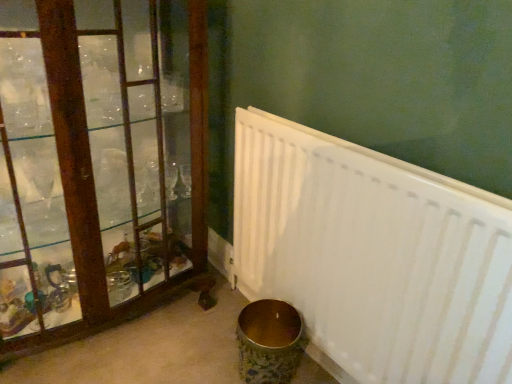
Question: Should I look upward or downward to see wooden frame at left?

Choices:
 (A) up
 (B) down

Answer: (A)

Question: Is white matte radiator at lower right positioned with its back to wooden frame at left?

Choices:
 (A) no
 (B) yes

Answer: (A)

Question: Are white matte radiator at lower right and wooden frame at left located far from each other?

Choices:
 (A) yes
 (B) no

Answer: (B)

Question: From a real-world perspective, is white matte radiator at lower right located higher than wooden frame at left?

Choices:
 (A) no
 (B) yes

Answer: (A)

Question: Does white matte radiator at lower right have a lesser height compared to wooden frame at left?

Choices:
 (A) yes
 (B) no

Answer: (A)

Question: Can you confirm if white matte radiator at lower right is positioned to the left of wooden frame at left?

Choices:
 (A) yes
 (B) no

Answer: (B)

Question: Is white matte radiator at lower right wider than wooden frame at left?

Choices:
 (A) yes
 (B) no

Answer: (B)

Question: Are wooden frame at left and white matte radiator at lower right beside each other?

Choices:
 (A) no
 (B) yes

Answer: (A)

Question: Is white matte radiator at lower right at the back of wooden frame at left?

Choices:
 (A) no
 (B) yes

Answer: (A)

Question: Could you tell me if wooden frame at left is turned towards white matte radiator at lower right?

Choices:
 (A) yes
 (B) no

Answer: (B)

Question: Can you confirm if wooden frame at left is positioned to the left of white matte radiator at lower right?

Choices:
 (A) no
 (B) yes

Answer: (B)

Question: Would you say wooden frame at left is outside white matte radiator at lower right?

Choices:
 (A) no
 (B) yes

Answer: (B)

Question: From a real-world perspective, is wooden frame at left positioned under white matte radiator at lower right based on gravity?

Choices:
 (A) no
 (B) yes

Answer: (A)

Question: Considering the positions of wooden frame at left and white matte radiator at lower right in the image, is wooden frame at left wider or thinner than white matte radiator at lower right?

Choices:
 (A) wide
 (B) thin

Answer: (A)